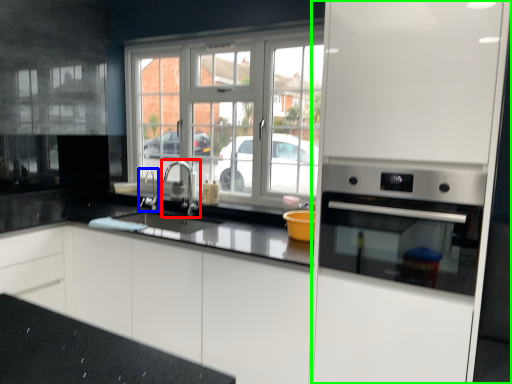
Question: Which object is the closest to the tap (highlighted by a red box)? Choose among these: faucet (highlighted by a blue box) or appliance (highlighted by a green box).

Choices:
 (A) faucet
 (B) appliance

Answer: (A)